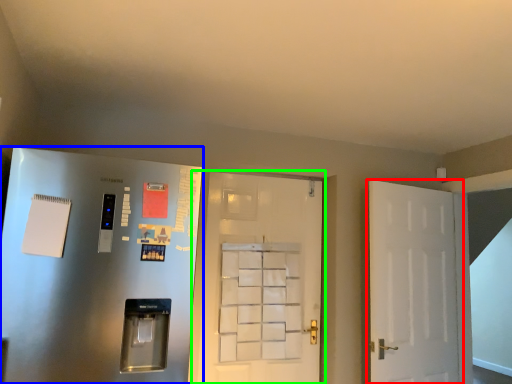
Question: Based on their relative distances, which object is nearer to door (highlighted by a red box)? Choose from door (highlighted by a blue box) and door (highlighted by a green box).

Choices:
 (A) door
 (B) door

Answer: (B)